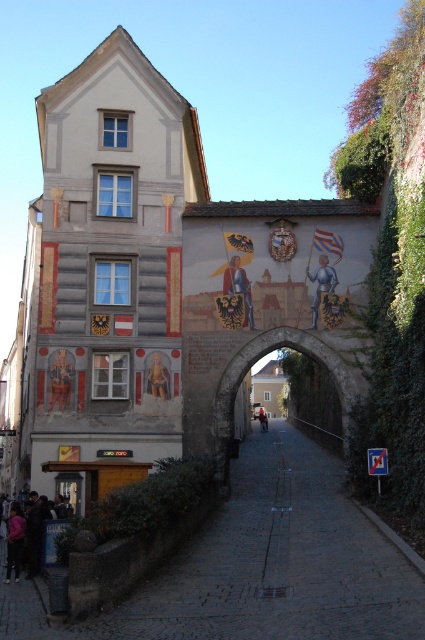
Question: Which of the following is the closest to the observer?

Choices:
 (A) stone archway at center
 (B) metallic armor at center

Answer: (A)

Question: Which point is farther to the camera?

Choices:
 (A) dark blue jeans at lower left
 (B) stone archway at center

Answer: (B)

Question: Can you confirm if matte gold painting at left is smaller than dark blue jeans at center?

Choices:
 (A) no
 (B) yes

Answer: (B)

Question: Which point is farther from the camera taking this photo?

Choices:
 (A) (159, 365)
 (B) (316, 308)
 (C) (249, 304)
 (D) (39, 548)

Answer: (C)

Question: Does dark blue jeans at lower left have a larger size compared to golden textured statue at center?

Choices:
 (A) yes
 (B) no

Answer: (B)

Question: Does golden armor at center have a smaller size compared to golden textured statue at center?

Choices:
 (A) yes
 (B) no

Answer: (A)